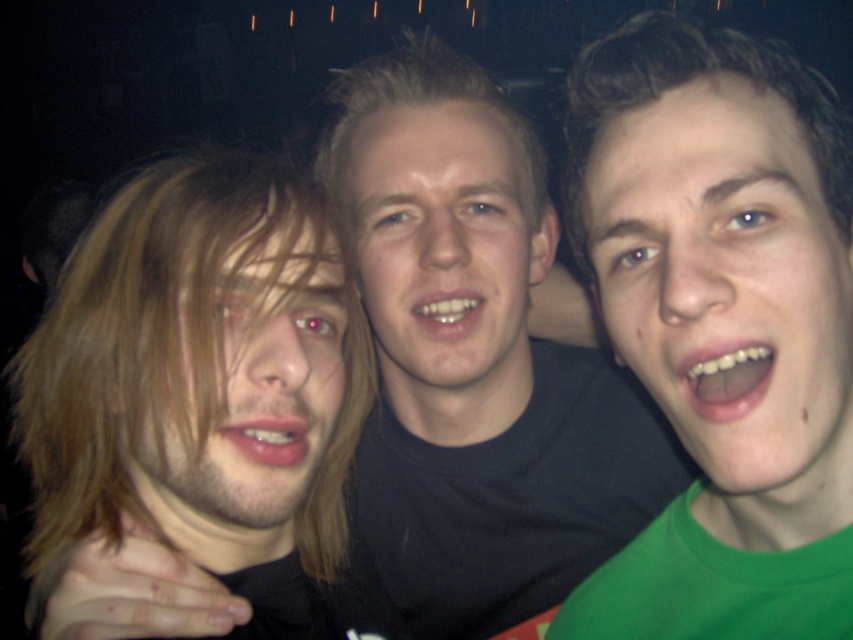
Question: Can you confirm if blonde hair at left is positioned to the right of blond hair at center?

Choices:
 (A) yes
 (B) no

Answer: (B)

Question: Can you confirm if black matte shirt at center is positioned below green matte face at right?

Choices:
 (A) yes
 (B) no

Answer: (A)

Question: Which object appears closest to the camera in this image?

Choices:
 (A) smooth skin face at center
 (B) green matte face at right
 (C) blond hair at center

Answer: (B)

Question: Which point appears closest to the camera in this image?

Choices:
 (A) (254, 371)
 (B) (73, 387)
 (C) (448, 99)
 (D) (526, 244)

Answer: (A)

Question: Does green matte face at right have a lesser width compared to smooth skin face at center?

Choices:
 (A) yes
 (B) no

Answer: (A)

Question: Which object is closer to the camera taking this photo?

Choices:
 (A) blonde hair at left
 (B) blond hair at center
 (C) green matte face at right

Answer: (C)